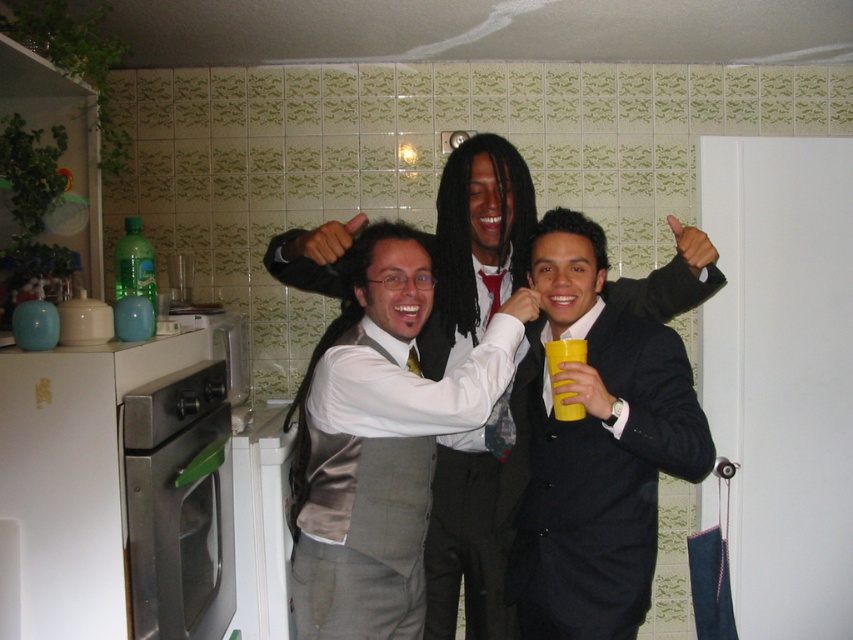
Does black satin suit at center appear on the right side of green plastic bottle at left?

Indeed, black satin suit at center is positioned on the right side of green plastic bottle at left.

Where is `black satin suit at center`? The width and height of the screenshot is (853, 640). black satin suit at center is located at coordinates (596, 449).

Does green plastic bottle at left have a smaller size compared to yellow matte cup at center?

No.

Identify the location of green plastic bottle at left. (134, 264).

Who is taller, satin gray vest at center or green plastic bottle at left?

satin gray vest at center is taller.

Is point (341, 593) less distant than point (122, 278)?

Yes, it is.

Between point (373, 390) and point (131, 285), which one is positioned in front?

Point (373, 390) is in front.

I want to click on satin gray vest at center, so click(379, 440).